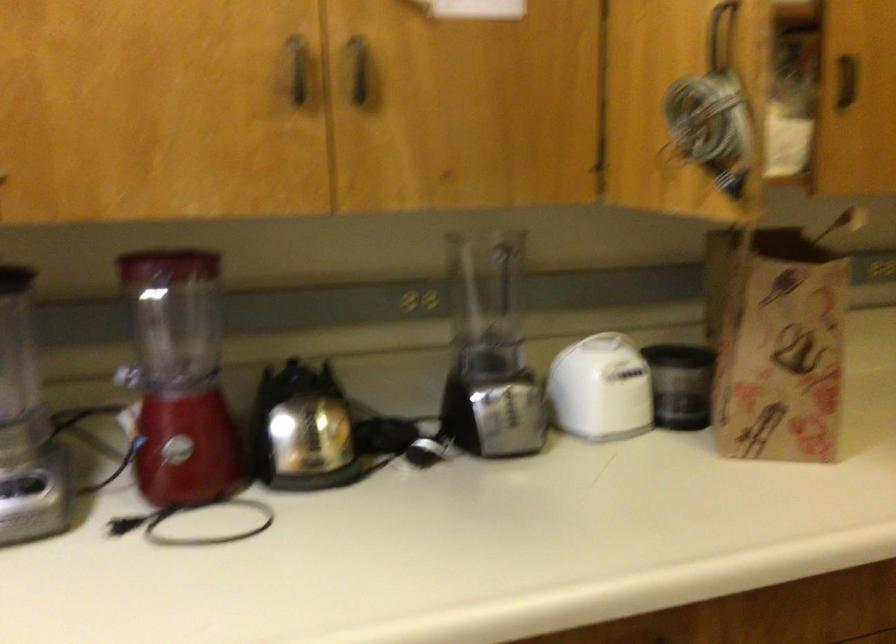
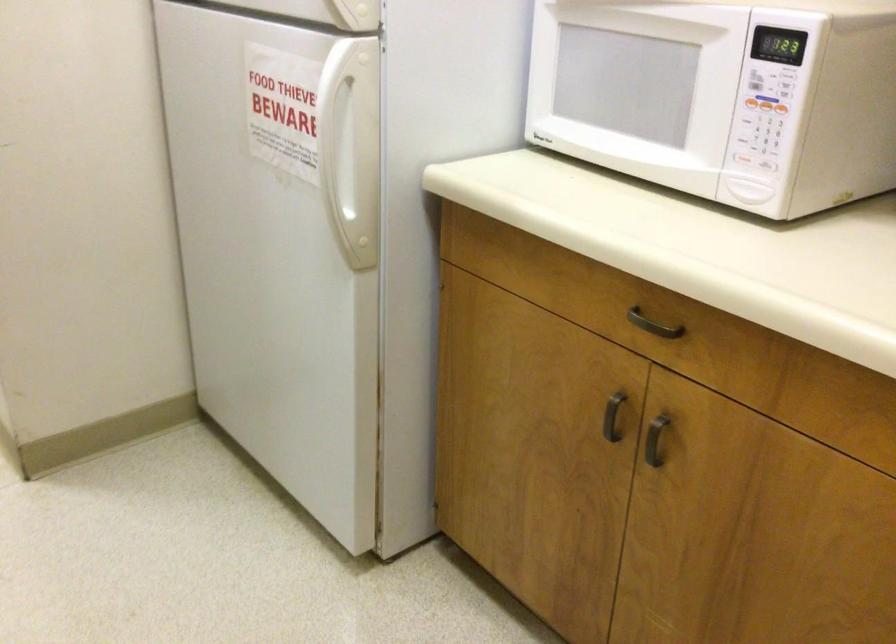
The images are taken continuously from a first-person perspective. In which direction is your viewpoint rotating?

The rotation direction of the camera is left-down.